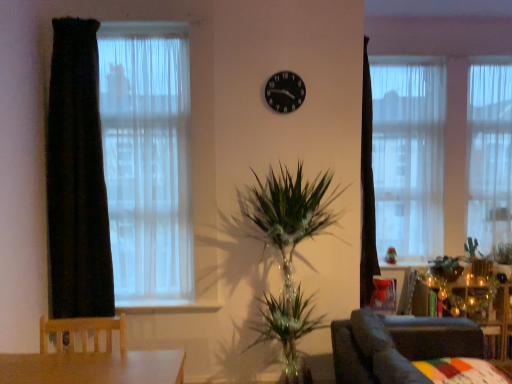
Question: Do you think white sheer curtain at upper right, the second curtain in the back-to-front sequence, is within white sheer curtain at right, the 1th curtain when ordered from back to front, or outside of it?

Choices:
 (A) outside
 (B) inside

Answer: (A)

Question: Looking at the image, does white sheer curtain at upper right, the second curtain from the right, seem bigger or smaller compared to white sheer curtain at right, the 1th curtain when ordered from back to front?

Choices:
 (A) big
 (B) small

Answer: (A)

Question: Based on their relative distances, which object is nearer to the green glossy plant at right?

Choices:
 (A) white sheer curtain at upper right, the second curtain when ordered from front to back
 (B) wooden side table at lower right
 (C) white sheer curtain at right, the 1th curtain when ordered from back to front
 (D) green leafy plant at right
 (E) dark velvet curtain at left, positioned as the 1th curtain in front-to-back order

Answer: (B)

Question: Which object is positioned farthest from the wooden side table at lower right?

Choices:
 (A) dark velvet curtain at left, the 1th curtain when ordered from left to right
 (B) white sheer curtain at left
 (C) green glossy plant at right
 (D) white sheer curtain at upper right, the second curtain when ordered from front to back
 (E) white sheer curtain at right, acting as the 3th curtain starting from the front

Answer: (A)